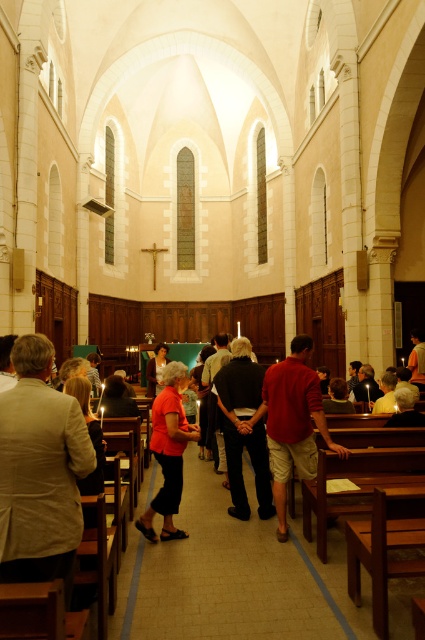
You are standing in the church and see the point at coordinates (39, 472). According to the image, where is this point located?

The point at coordinates (39, 472) is located on the light brown linen jacket at left.

Consider the image. You are a photographer standing at the entrance of the church. You want to take a photo that includes both the light brown linen jacket at left and the red cotton shirt at center. Given that your camera has a maximum focus range of 20 feet, will you be able to capture both subjects in focus without moving closer?

The distance between the light brown linen jacket at left and the red cotton shirt at center is 25.69 feet, which exceeds the camera maximum focus range of 20 feet. Therefore, you will not be able to capture both subjects in focus without moving closer.

You are standing inside the church and notice two points marked on the floor. The first point is at coordinate point (265,410) and the second is at point (173,426). Which point is closer to you as you stand facing the altar?

Point (265,410) is closer to you because it is further to the viewer than point (173,426), meaning it is nearer to your current position in the church.